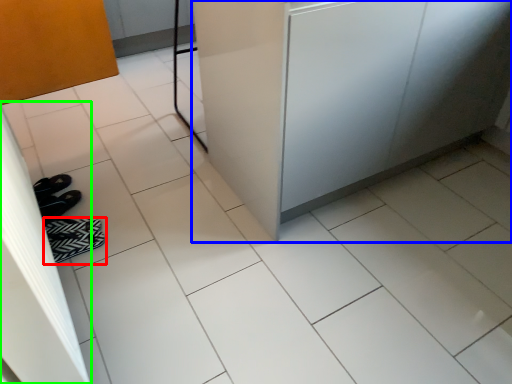
Question: Considering the real-world distances, which object is closest to footwear (highlighted by a red box)? counter (highlighted by a blue box) or screen door (highlighted by a green box).

Choices:
 (A) counter
 (B) screen door

Answer: (B)